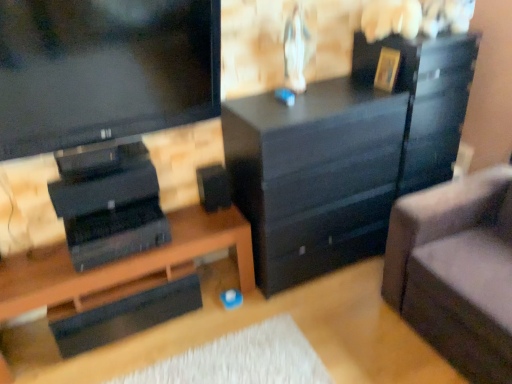
Question: Could you tell me if gold metallic picture frame at upper right is turned towards glossy black file cabinet at right?

Choices:
 (A) yes
 (B) no

Answer: (B)

Question: Can you confirm if gold metallic picture frame at upper right is positioned to the right of glossy black file cabinet at right?

Choices:
 (A) yes
 (B) no

Answer: (B)

Question: Is gold metallic picture frame at upper right bigger than glossy black file cabinet at right?

Choices:
 (A) no
 (B) yes

Answer: (A)

Question: Is glossy black file cabinet at right surrounded by gold metallic picture frame at upper right?

Choices:
 (A) yes
 (B) no

Answer: (B)

Question: Does gold metallic picture frame at upper right have a greater height compared to glossy black file cabinet at right?

Choices:
 (A) yes
 (B) no

Answer: (B)

Question: Is gold metallic picture frame at upper right turned away from glossy black file cabinet at right?

Choices:
 (A) yes
 (B) no

Answer: (A)

Question: From a real-world perspective, is suede gray couch at right below black matte speaker at center?

Choices:
 (A) no
 (B) yes

Answer: (B)

Question: Is suede gray couch at right further to camera compared to black matte speaker at center?

Choices:
 (A) no
 (B) yes

Answer: (A)

Question: Is suede gray couch at right looking in the opposite direction of black matte speaker at center?

Choices:
 (A) no
 (B) yes

Answer: (A)

Question: Can you see suede gray couch at right touching black matte speaker at center?

Choices:
 (A) no
 (B) yes

Answer: (A)

Question: Does suede gray couch at right have a smaller size compared to black matte speaker at center?

Choices:
 (A) yes
 (B) no

Answer: (B)

Question: Does suede gray couch at right have a greater height compared to black matte speaker at center?

Choices:
 (A) yes
 (B) no

Answer: (A)

Question: Does suede gray couch at right have a larger size compared to gold metallic picture frame at upper right?

Choices:
 (A) no
 (B) yes

Answer: (B)